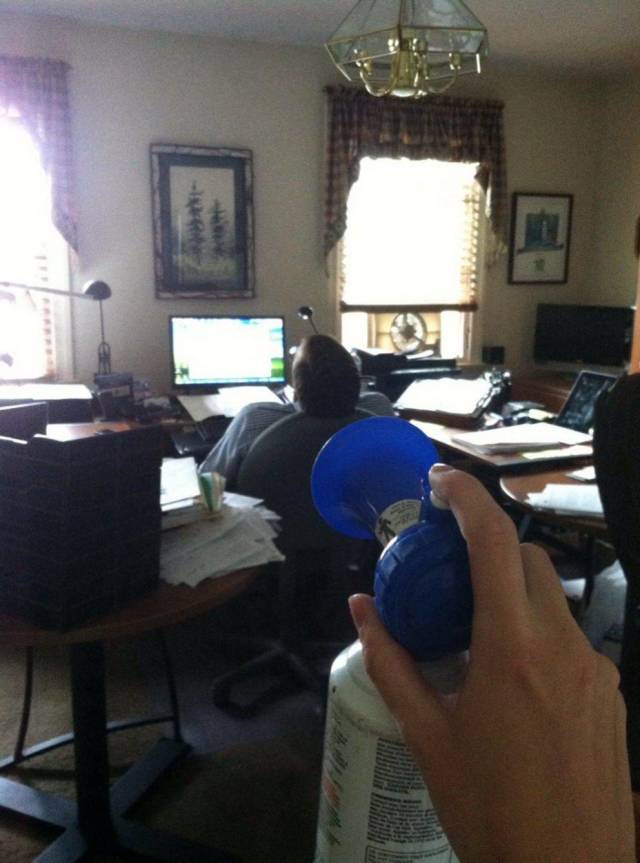
This screenshot has width=640, height=863. Find the location of `computer desk`. computer desk is located at coordinates (212, 419).